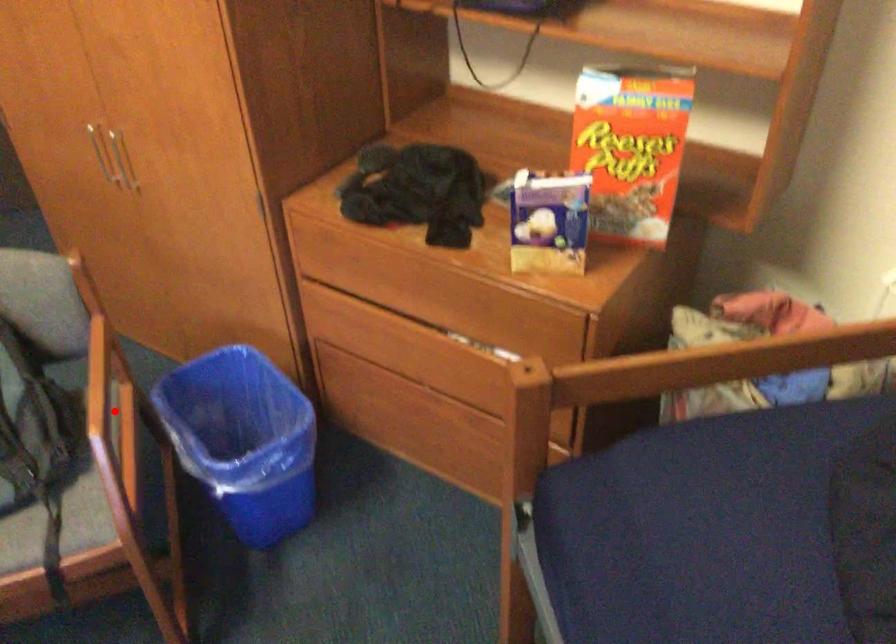
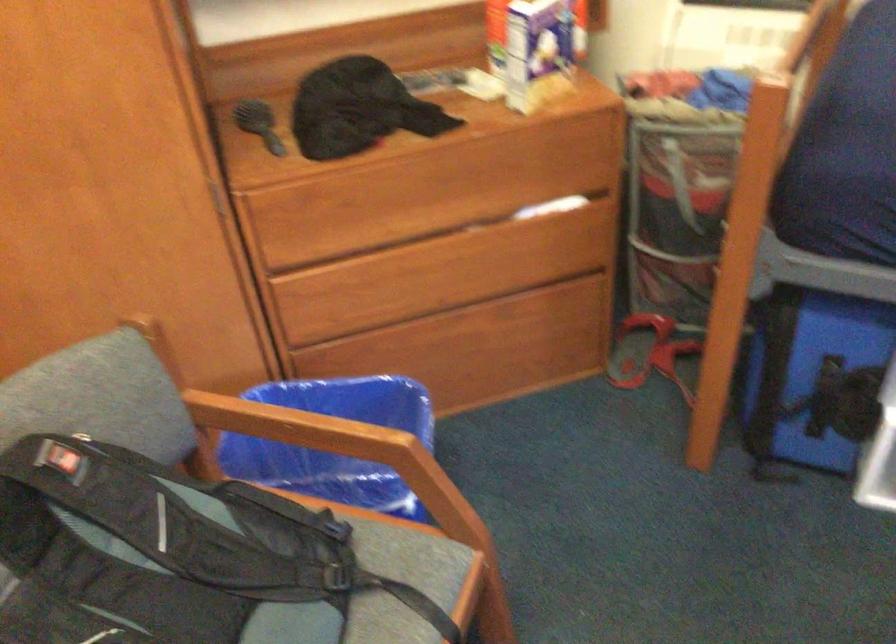
Find the pixel in the second image that matches the highlighted location in the first image.

(334, 440)